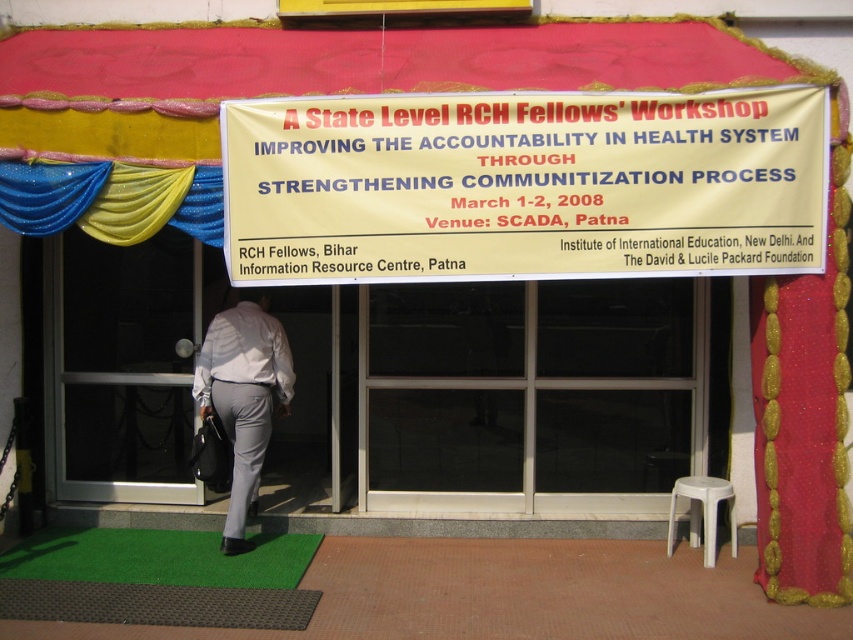
Question: Does transparent glass door at left have a larger size compared to white plastic stool at lower right?

Choices:
 (A) yes
 (B) no

Answer: (A)

Question: Is green artificial turf mat at lower center positioned at the back of white plastic stool at lower right?

Choices:
 (A) yes
 (B) no

Answer: (B)

Question: Which object is closer to the camera taking this photo?

Choices:
 (A) transparent glass door at left
 (B) red fabric curtain at right
 (C) yellow paper banner at center

Answer: (C)

Question: Among these objects, which one is nearest to the camera?

Choices:
 (A) red fabric curtain at right
 (B) yellow paper banner at center

Answer: (B)

Question: Which of the following is the farthest from the observer?

Choices:
 (A) (833, 561)
 (B) (238, 132)
 (C) (701, 504)
 (D) (112, 346)

Answer: (D)

Question: Is red fabric curtain at right below glittery fabric drapes at upper left?

Choices:
 (A) no
 (B) yes

Answer: (B)